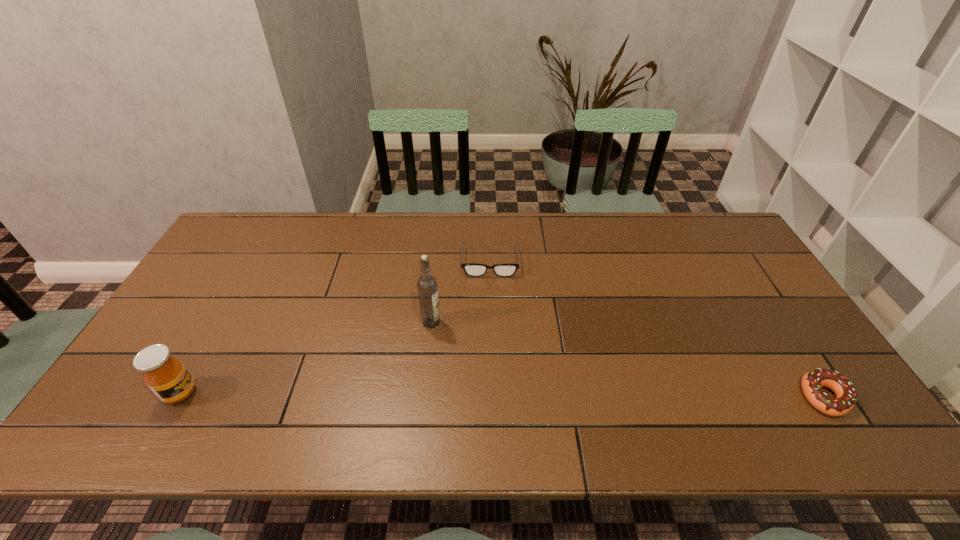
Where is `free space between the second object from right to left and the doughnut`? This screenshot has height=540, width=960. free space between the second object from right to left and the doughnut is located at coordinates point(658,330).

Image resolution: width=960 pixels, height=540 pixels. Identify the location of blank region between the second farthest object and the leftmost object. (305, 357).

Find the location of a particular element. vacant area that lies between the spectacles and the vodka is located at coordinates (461, 292).

Find the location of a particular element. vacant space that's between the doughnut and the spectacles is located at coordinates (658, 330).

You are a GUI agent. You are given a task and a screenshot of the screen. Output one action in this format:
    pyautogui.click(x=<x>, y=<y>)
    Task: Click on the free space between the third object from right to left and the honey
    
    Given the screenshot: What is the action you would take?
    point(305,357)

Find the location of `free space between the doughnut and the farthest object`. free space between the doughnut and the farthest object is located at coordinates click(x=658, y=330).

The height and width of the screenshot is (540, 960). What are the coordinates of `object that can be found as the second closest to the third object from left to right` in the screenshot? It's located at 167,377.

Select which object appears as the third closest to the farthest object. Please provide its 2D coordinates. Your answer should be formatted as a tuple, i.e. [(x, y)], where the tuple contains the x and y coordinates of a point satisfying the conditions above.

[(812, 382)]